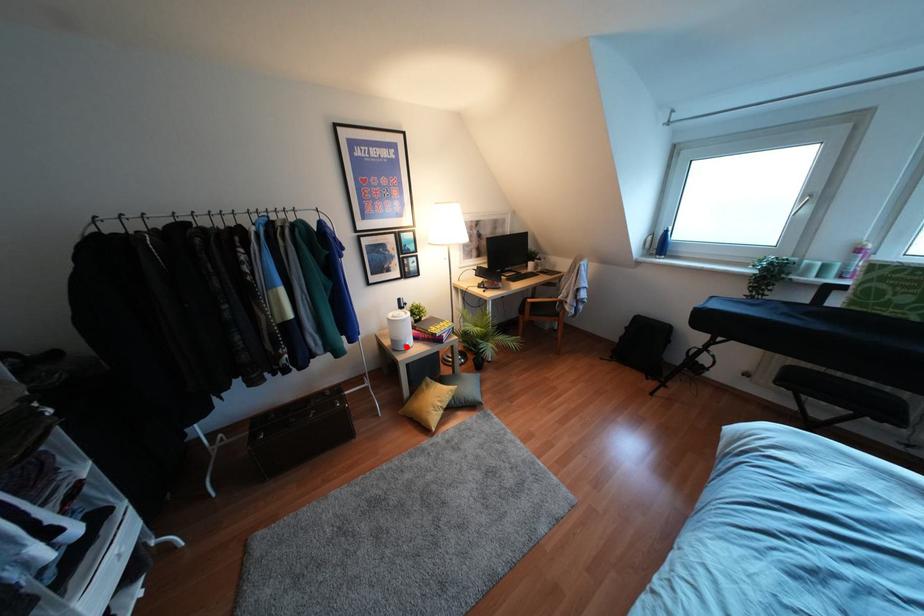
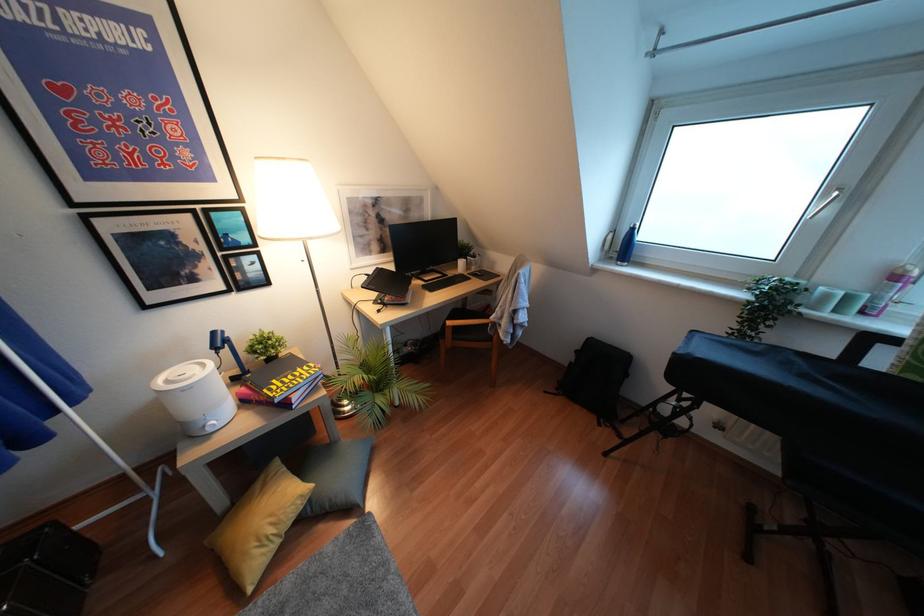
The point at the highlighted location is marked in the first image. Where is the corresponding point in the second image?

(210, 430)